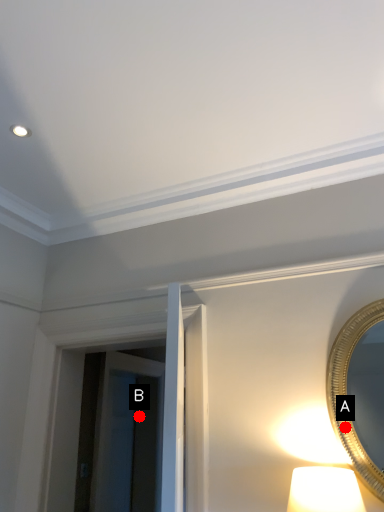
Question: Two points are circled on the image, labeled by A and B beside each circle. Which point is further to the camera?

Choices:
 (A) A is further
 (B) B is further

Answer: (B)